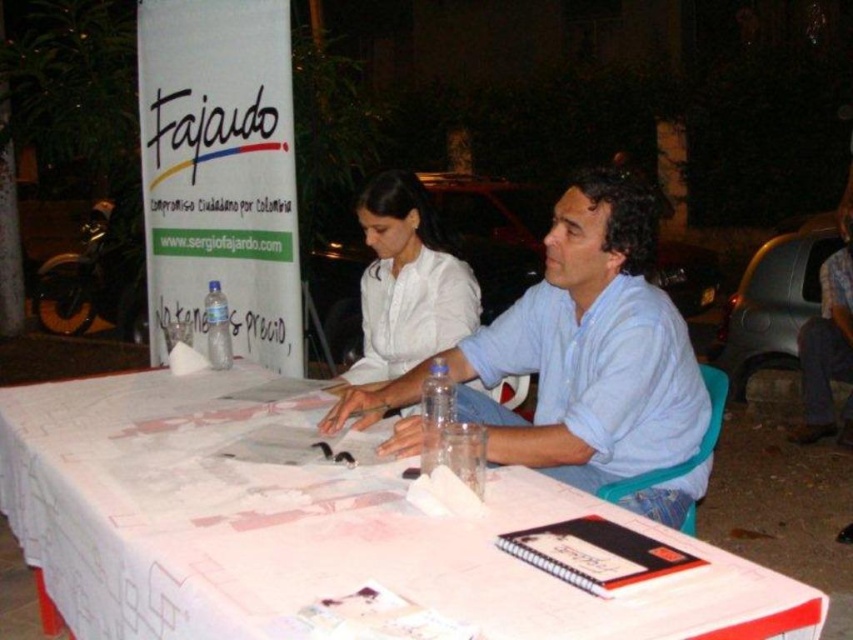
Can you confirm if white paper at center is positioned to the left of light blue shirt at center?

Indeed, white paper at center is positioned on the left side of light blue shirt at center.

Which is below, white paper at center or light blue shirt at center?

white paper at center is lower down.

I want to click on white paper at center, so click(x=305, y=531).

Who is more distant from viewer, (538, 588) or (392, 392)?

Point (392, 392)

Is point (656, 529) positioned before point (413, 403)?

Yes, point (656, 529) is closer to viewer.

Where is `white paper at center`? white paper at center is located at coordinates (305, 531).

Which is more to the left, light blue shirt at center or white matte shirt at center?

Positioned to the left is white matte shirt at center.

Is light blue shirt at center smaller than white matte shirt at center?

No.

Locate an element on the screen. This screenshot has height=640, width=853. light blue shirt at center is located at coordinates (590, 348).

Identify the location of light blue shirt at center. (590, 348).